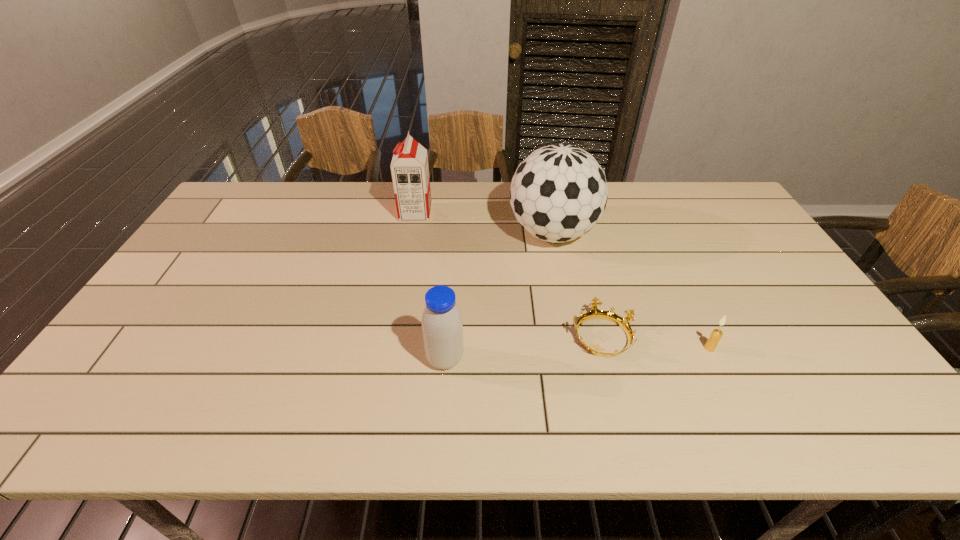
Locate an element on the screen. This screenshot has height=540, width=960. vacant point located 0.400m on the back of the second object from left to right is located at coordinates (453, 245).

Find the location of a particular element. This screenshot has width=960, height=540. free region located 0.050m on the right of the rightmost object is located at coordinates (734, 348).

Locate an element on the screen. blank area located 0.200m on the right of the crown is located at coordinates (710, 336).

Where is `soccer ball positioned at the far edge`? The image size is (960, 540). soccer ball positioned at the far edge is located at coordinates (558, 193).

I want to click on soya milk that is at the far edge, so click(410, 172).

Locate an element on the screen. The height and width of the screenshot is (540, 960). vacant space at the far edge of the desktop is located at coordinates (367, 200).

Image resolution: width=960 pixels, height=540 pixels. Find the location of `vacant region at the near edge of the desktop`. vacant region at the near edge of the desktop is located at coordinates click(x=817, y=434).

In the image, there is a desktop. At what (x,y) coordinates should I click in order to perform the action: click on vacant space at the left edge. Please return your answer as a coordinate pair (x, y). This screenshot has width=960, height=540. Looking at the image, I should click on coord(162,339).

Identify the location of free space at the right edge of the desktop. This screenshot has height=540, width=960. tap(722, 233).

In the image, there is a desktop. Where is `vacant space at the far left corner`? This screenshot has height=540, width=960. vacant space at the far left corner is located at coordinates (245, 183).